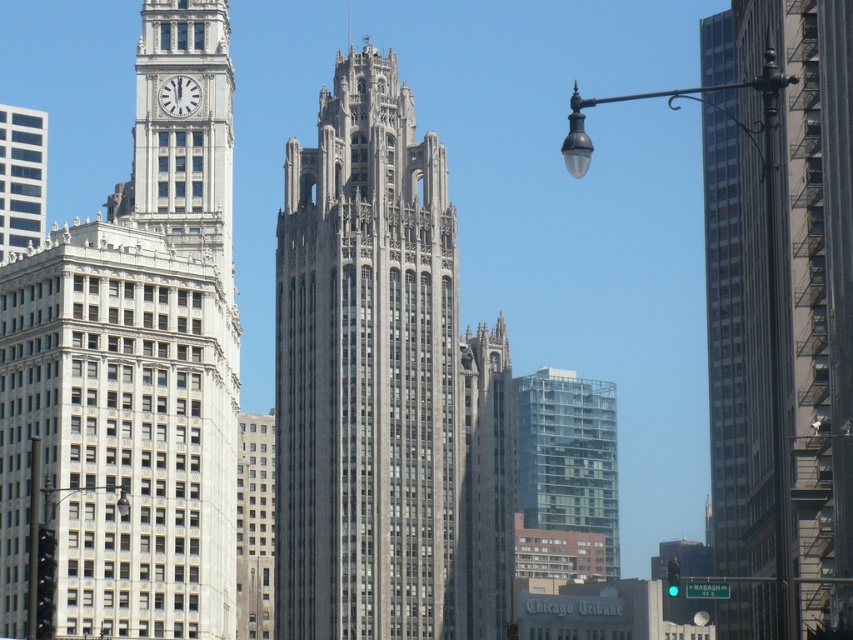
Question: Is white stone clock tower at left positioned at the back of clear glass building at center?

Choices:
 (A) yes
 (B) no

Answer: (B)

Question: Considering the relative positions of white stone clock tower at left and smooth glass skyscraper at right in the image provided, where is white stone clock tower at left located with respect to smooth glass skyscraper at right?

Choices:
 (A) left
 (B) right

Answer: (A)

Question: Which object is positioned closest to the clear glass building at center?

Choices:
 (A) black glass lamp post at left
 (B) matte black streetlight at right

Answer: (B)

Question: Which of the following is the farthest from the observer?

Choices:
 (A) (53, 584)
 (B) (618, 576)
 (C) (750, 406)

Answer: (B)

Question: Which object appears closest to the camera in this image?

Choices:
 (A) black glass lamp post at left
 (B) gray stone tower at center
 (C) smooth glass skyscraper at right

Answer: (A)

Question: Is white stone clock tower at left behind black glass lamp post at left?

Choices:
 (A) no
 (B) yes

Answer: (B)